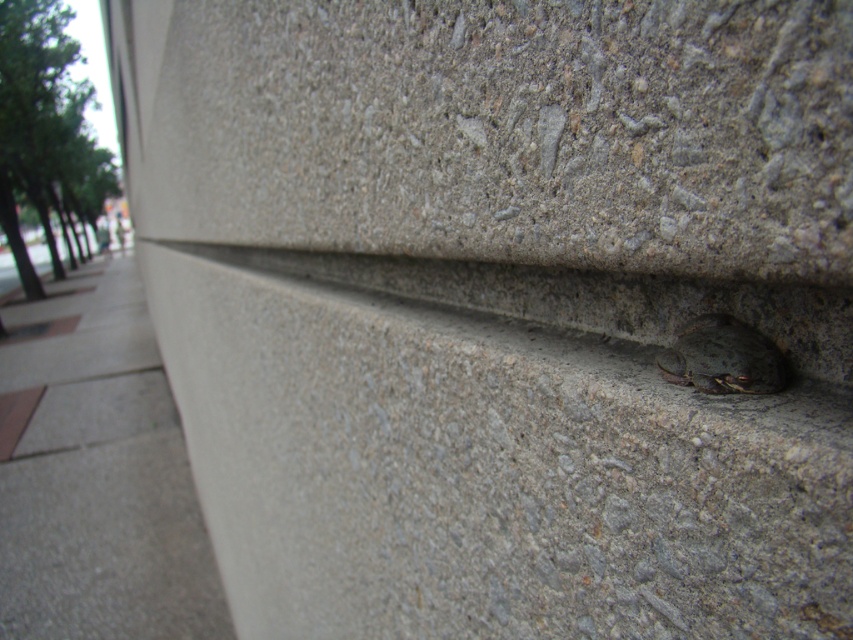
Between gray concrete wall at lower right and gray concrete pavement at lower left, which one is positioned higher?

gray concrete wall at lower right is higher up.

The image size is (853, 640). What do you see at coordinates (503, 131) in the screenshot? I see `gray concrete wall at lower right` at bounding box center [503, 131].

The height and width of the screenshot is (640, 853). What do you see at coordinates (503, 131) in the screenshot?
I see `gray concrete wall at lower right` at bounding box center [503, 131].

Locate an element on the screen. The width and height of the screenshot is (853, 640). gray concrete wall at lower right is located at coordinates (503, 131).